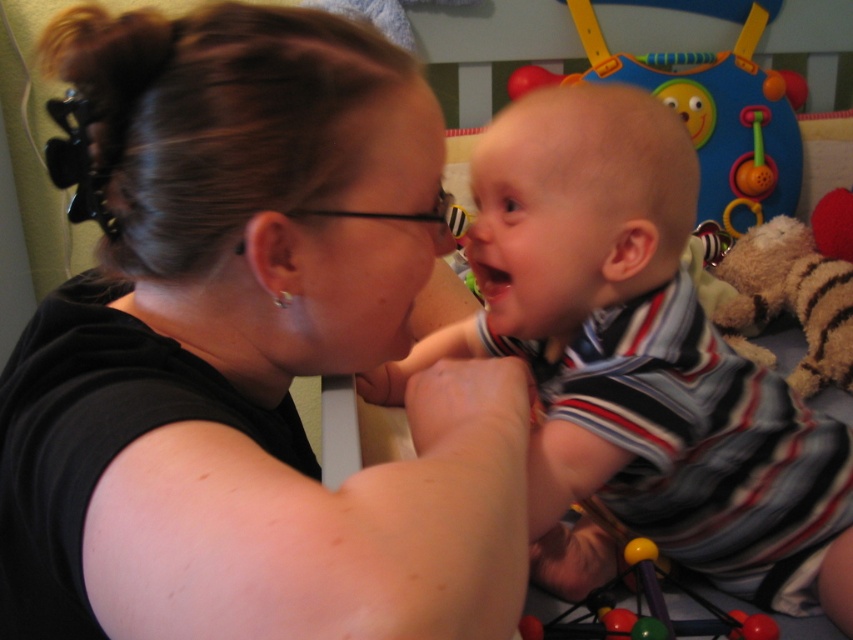
Is black matte shirt at center behind rubberized plastic beads at lower center?

No, black matte shirt at center is closer to the viewer.

Does black matte shirt at center have a lesser height compared to rubberized plastic beads at lower center?

In fact, black matte shirt at center may be taller than rubberized plastic beads at lower center.

What do you see at coordinates (248, 353) in the screenshot? The image size is (853, 640). I see `black matte shirt at center` at bounding box center [248, 353].

The height and width of the screenshot is (640, 853). I want to click on black matte shirt at center, so click(x=248, y=353).

This screenshot has height=640, width=853. I want to click on plastic colorful activity center at upper center, so click(709, 108).

Can you confirm if plastic colorful activity center at upper center is positioned below rubberized plastic beads at lower center?

No, plastic colorful activity center at upper center is not below rubberized plastic beads at lower center.

This screenshot has height=640, width=853. What do you see at coordinates (709, 108) in the screenshot?
I see `plastic colorful activity center at upper center` at bounding box center [709, 108].

The width and height of the screenshot is (853, 640). What are the coordinates of `plastic colorful activity center at upper center` in the screenshot? It's located at tap(709, 108).

Is striped fabric shirt at center above pink matte mouth at center?

No.

Is point (506, 138) positioned in front of point (495, 268)?

Yes, it is in front of point (495, 268).

Between point (718, 522) and point (483, 282), which one is positioned in front?

Point (483, 282) is in front.

Identify the location of striped fabric shirt at center. (637, 364).